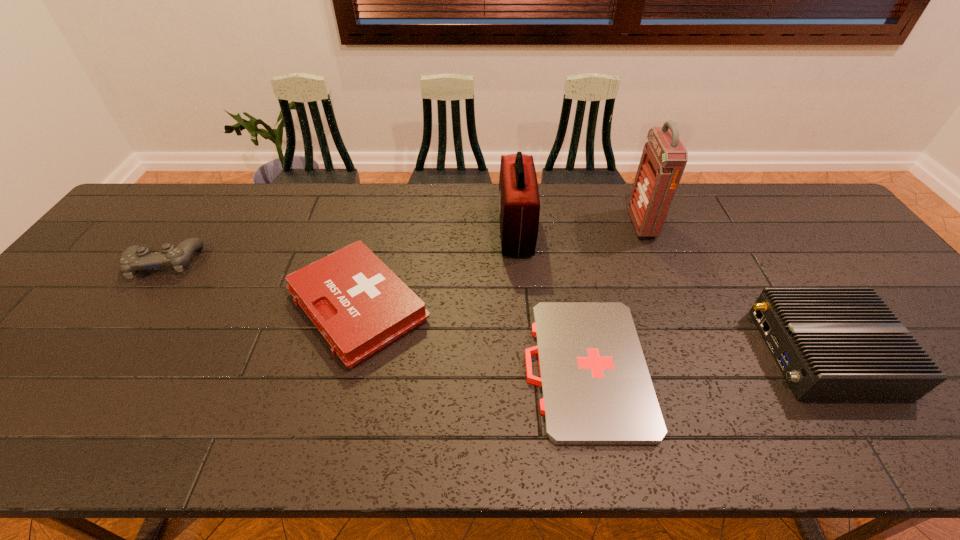
I want to click on vacant space situated 0.130m on the front-facing side of the tallest first-aid kit, so click(590, 224).

Locate an element on the screen. The image size is (960, 540). vacant space located 0.050m on the front-facing side of the tallest first-aid kit is located at coordinates (616, 224).

Locate an element on the screen. The image size is (960, 540). free location located 0.110m on the side of the second tallest first-aid kit with the cross symbol is located at coordinates (463, 231).

Locate an element on the screen. vacant space located 0.210m on the side of the second tallest first-aid kit with the cross symbol is located at coordinates (430, 231).

Locate an element on the screen. The width and height of the screenshot is (960, 540). free space located 0.090m on the side of the second tallest first-aid kit with the cross symbol is located at coordinates [469, 231].

This screenshot has height=540, width=960. Identify the location of vacant region located on the back panel of the rightmost object. (621, 353).

This screenshot has height=540, width=960. What are the coordinates of `free space located 0.070m on the back panel of the rightmost object` in the screenshot? It's located at (732, 353).

Where is `vacant space located 0.120m on the back panel of the rightmost object`? vacant space located 0.120m on the back panel of the rightmost object is located at coordinates (710, 353).

Locate an element on the screen. vacant position located on the front of the control is located at coordinates (98, 355).

I want to click on free space located on the left of the second object from left to right, so click(x=156, y=307).